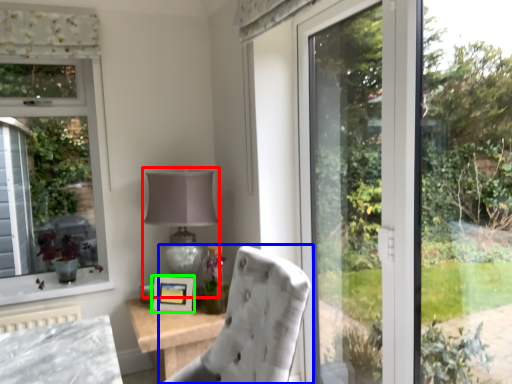
Question: Which object is the closest to the table lamp (highlighted by a red box)? Choose among these: chair (highlighted by a blue box) or picture frame (highlighted by a green box).

Choices:
 (A) chair
 (B) picture frame

Answer: (B)